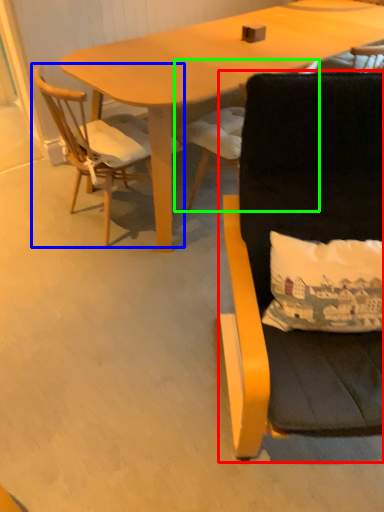
Question: Based on their relative distances, which object is farther from chair (highlighted by a red box)? Choose from chair (highlighted by a blue box) and chair (highlighted by a green box).

Choices:
 (A) chair
 (B) chair

Answer: (A)